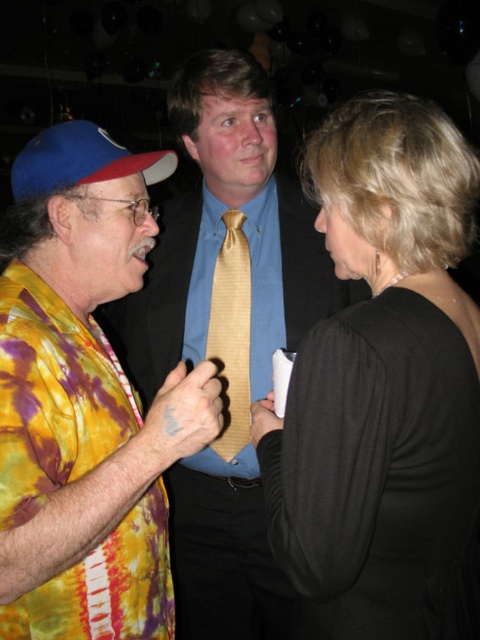
Question: Does black satin dress at center come in front of gold striped tie at center?

Choices:
 (A) no
 (B) yes

Answer: (B)

Question: Where is matte gold tie at center located in relation to gold striped tie at center in the image?

Choices:
 (A) above
 (B) below

Answer: (B)

Question: Which of the following is the closest to the observer?

Choices:
 (A) blue satin dress shirt at center
 (B) gold striped tie at center
 (C) tie-dye fabric shirt at left

Answer: (C)

Question: Which object is positioned farthest from the gold striped tie at center?

Choices:
 (A) matte gold tie at center
 (B) blue satin dress shirt at center

Answer: (A)

Question: Among these points, which one is nearest to the camera?

Choices:
 (A) (251, 218)
 (B) (66, 362)
 (C) (220, 362)

Answer: (B)

Question: Does matte gold tie at center appear on the right side of tie-dye fabric shirt at left?

Choices:
 (A) yes
 (B) no

Answer: (A)